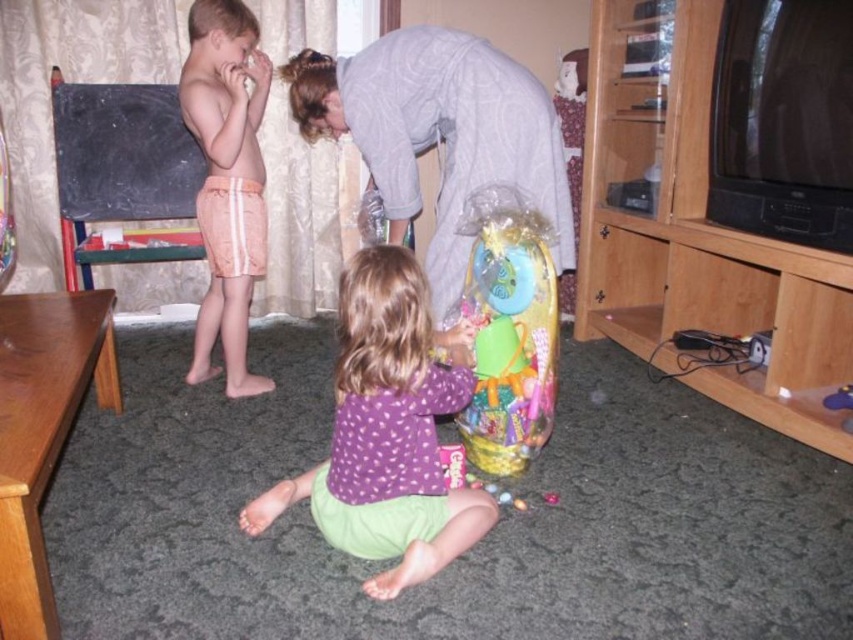
Which is below, gray cotton shirt at upper center or pink striped shorts at left?

pink striped shorts at left

Can you confirm if gray cotton shirt at upper center is positioned below pink striped shorts at left?

Incorrect, gray cotton shirt at upper center is not positioned below pink striped shorts at left.

You are a GUI agent. You are given a task and a screenshot of the screen. Output one action in this format:
    pyautogui.click(x=<x>, y=<y>)
    Task: Click on the gray cotton shirt at upper center
    This screenshot has height=640, width=853.
    Given the screenshot: What is the action you would take?
    pyautogui.click(x=438, y=132)

Is point (373, 102) farther from camera compared to point (496, 285)?

Yes, it is.

Who is taller, gray cotton shirt at upper center or translucent plastic basket at center?

With more height is gray cotton shirt at upper center.

Which is in front, point (508, 97) or point (537, 298)?

Point (537, 298)

Image resolution: width=853 pixels, height=640 pixels. In order to click on gray cotton shirt at upper center in this screenshot , I will do `click(438, 132)`.

Who is positioned more to the left, purple fabric shirt at center or pink striped shorts at left?

From the viewer's perspective, pink striped shorts at left appears more on the left side.

What are the coordinates of `purple fabric shirt at center` in the screenshot? It's located at (387, 429).